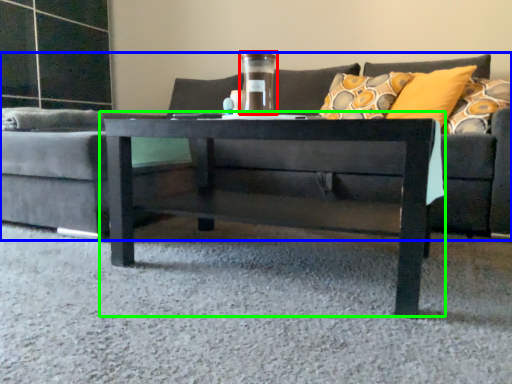
Question: Which object is the closest to the glass vase (highlighted by a red box)? Choose among these: studio couch (highlighted by a blue box) or coffee table (highlighted by a green box).

Choices:
 (A) studio couch
 (B) coffee table

Answer: (B)